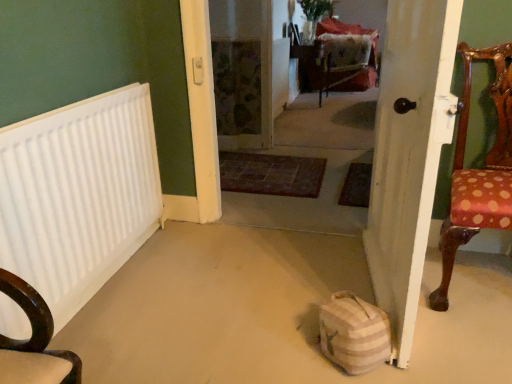
Where is `white wooden door at right`? white wooden door at right is located at coordinates (409, 154).

This screenshot has height=384, width=512. What do you see at coordinates (345, 62) in the screenshot?
I see `velvet red armchair at center` at bounding box center [345, 62].

The height and width of the screenshot is (384, 512). Identify the location of white matte radiator at left. (78, 195).

Considering the sizes of objects velvet red armchair at center and striped fabric bag at lower center in the image provided, who is shorter, velvet red armchair at center or striped fabric bag at lower center?

Standing shorter between the two is striped fabric bag at lower center.

Do you think velvet red armchair at center is within striped fabric bag at lower center, or outside of it?

velvet red armchair at center exists outside the volume of striped fabric bag at lower center.

What's the angular difference between velvet red armchair at center and striped fabric bag at lower center's facing directions?

There is a 135-degree angle between the facing directions of velvet red armchair at center and striped fabric bag at lower center.

Which of these two, velvet red armchair at center or striped fabric bag at lower center, is smaller?

striped fabric bag at lower center is smaller.

Which of these two, velvet red armchair at center or white wooden door at right, is wider?

Wider between the two is velvet red armchair at center.

Does point (347, 52) come behind point (429, 87)?

Yes.

Where is `armchair that is on the right side of white wooden door at right`? armchair that is on the right side of white wooden door at right is located at coordinates (345, 62).

Which of these two, velvet red armchair at center or white wooden door at right, is bigger?

With larger size is velvet red armchair at center.

Is carpeted floor at center facing away from white wooden door at right?

carpeted floor at center does not have its back to white wooden door at right.

From the picture: In the image, is carpeted floor at center positioned in front of or behind white wooden door at right?

Clearly, carpeted floor at center is behind white wooden door at right.

From a real-world perspective, is carpeted floor at center positioned above or below white wooden door at right?

Clearly, from a real-world perspective, carpeted floor at center is above white wooden door at right.

The width and height of the screenshot is (512, 384). What are the coordinates of `door below the carpeted floor at center (from a real-world perspective)` in the screenshot? It's located at (409, 154).

Is white wooden door at right further to the viewer compared to polka dot fabric chair at right?

That is False.

Is white wooden door at right shorter than polka dot fabric chair at right?

No, white wooden door at right is not shorter than polka dot fabric chair at right.

Where is `chair lying below the white wooden door at right (from the image's perspective)`? The image size is (512, 384). chair lying below the white wooden door at right (from the image's perspective) is located at coordinates (478, 170).

What's the angular difference between white wooden door at right and polka dot fabric chair at right's facing directions?

81.9 degrees separate the facing orientations of white wooden door at right and polka dot fabric chair at right.

Is polka dot fabric chair at right closer to the viewer compared to velvet red armchair at center?

Yes, polka dot fabric chair at right is closer to the camera.

Can you confirm if polka dot fabric chair at right is bigger than velvet red armchair at center?

Yes, polka dot fabric chair at right is bigger than velvet red armchair at center.

Does polka dot fabric chair at right turn towards velvet red armchair at center?

No.

Is the surface of polka dot fabric chair at right in direct contact with velvet red armchair at center?

There is a gap between polka dot fabric chair at right and velvet red armchair at center.

Is white wooden door at right facing towards carpeted floor at center?

Yes, white wooden door at right is facing carpeted floor at center.

How many degrees apart are the facing directions of white wooden door at right and carpeted floor at center?

The facing directions of white wooden door at right and carpeted floor at center are 81.5 degrees apart.

Is white wooden door at right far from carpeted floor at center?

white wooden door at right is far away from carpeted floor at center.

Does point (426, 236) come closer to viewer compared to point (316, 152)?

That is True.

Is polka dot fabric chair at right facing towards white wooden door at right?

No.

Consider the image. Which of these two, polka dot fabric chair at right or white wooden door at right, is bigger?

Bigger between the two is polka dot fabric chair at right.

Can you confirm if polka dot fabric chair at right is taller than white wooden door at right?

Incorrect, the height of polka dot fabric chair at right is not larger of that of white wooden door at right.

This screenshot has width=512, height=384. Find the location of `armchair on the right of striped fabric bag at lower center`. armchair on the right of striped fabric bag at lower center is located at coordinates (345, 62).

Where is `door located below the velvet red armchair at center (from the image's perspective)`? Image resolution: width=512 pixels, height=384 pixels. door located below the velvet red armchair at center (from the image's perspective) is located at coordinates (409, 154).

Which object lies nearer to the anchor point white matte radiator at left, carpeted floor at center or white wooden door at right?

white wooden door at right lies closer to white matte radiator at left than the other object.

Which object lies further to the anchor point white matte radiator at left, polka dot fabric chair at right or white wooden door at right?

Based on the image, polka dot fabric chair at right appears to be further to white matte radiator at left.

Which object lies further to the anchor point white wooden door at right, striped fabric bag at lower center or polka dot fabric chair at right?

striped fabric bag at lower center.

Based on their spatial positions, is white matte radiator at left or velvet red armchair at center closer to striped fabric bag at lower center?

Among the two, white matte radiator at left is located nearer to striped fabric bag at lower center.

From the picture: Looking at the image, which one is located further to carpeted floor at center, striped fabric bag at lower center or white matte radiator at left?

The object further to carpeted floor at center is striped fabric bag at lower center.

Considering their positions, is striped fabric bag at lower center positioned further to white wooden door at right than velvet red armchair at center?

The object further to white wooden door at right is velvet red armchair at center.

From the image, which object appears to be farther from polka dot fabric chair at right, white matte radiator at left or carpeted floor at center?

white matte radiator at left is positioned further to the anchor polka dot fabric chair at right.

Estimate the real-world distances between objects in this image. Which object is further from white matte radiator at left, white wooden door at right or striped fabric bag at lower center?

white wooden door at right is positioned further to the anchor white matte radiator at left.

Find the location of a particular element. The height and width of the screenshot is (384, 512). corridor located between striped fabric bag at lower center and velvet red armchair at center in the depth direction is located at coordinates (313, 156).

This screenshot has height=384, width=512. What are the coordinates of `corridor situated between white matte radiator at left and white wooden door at right from left to right` in the screenshot? It's located at (313, 156).

The height and width of the screenshot is (384, 512). What are the coordinates of `chair positioned between white matte radiator at left and velvet red armchair at center from near to far` in the screenshot? It's located at (478, 170).

Image resolution: width=512 pixels, height=384 pixels. Identify the location of door between striped fabric bag at lower center and polka dot fabric chair at right in the horizontal direction. (409, 154).